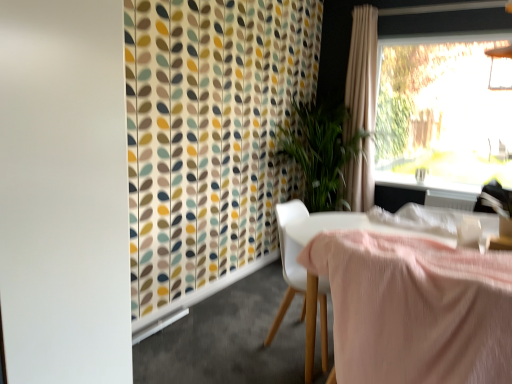
This screenshot has height=384, width=512. What do you see at coordinates (444, 112) in the screenshot? I see `transparent glass window at upper right` at bounding box center [444, 112].

This screenshot has height=384, width=512. I want to click on beige fabric curtain at upper right, so click(362, 71).

The width and height of the screenshot is (512, 384). What do you see at coordinates (64, 192) in the screenshot?
I see `white matte screen door at left` at bounding box center [64, 192].

I want to click on white plastic chair at center, so click(289, 261).

Where is `transparent glass window at upper right`? The height and width of the screenshot is (384, 512). transparent glass window at upper right is located at coordinates (444, 112).

Is point (424, 114) behind point (365, 93)?

Yes, it is.

Is transparent glass window at upper right in front of beige fabric curtain at upper right?

Yes, transparent glass window at upper right is closer to the camera.

From their relative heights in the image, would you say transparent glass window at upper right is taller or shorter than beige fabric curtain at upper right?

Clearly, transparent glass window at upper right is shorter compared to beige fabric curtain at upper right.

Does transparent glass window at upper right have a larger size compared to beige fabric curtain at upper right?

Incorrect, transparent glass window at upper right is not larger than beige fabric curtain at upper right.

Is white glossy window sill at upper right oriented towards white matte screen door at left?

No.

Considering the points (405, 175) and (110, 373), which point is in front, point (405, 175) or point (110, 373)?

The point (110, 373) is more forward.

How many degrees apart are the facing directions of white glossy window sill at upper right and white matte screen door at left?

There is a 180-degree angle between the facing directions of white glossy window sill at upper right and white matte screen door at left.

Can you confirm if white glossy window sill at upper right is shorter than white matte screen door at left?

Indeed, white glossy window sill at upper right has a lesser height compared to white matte screen door at left.

Could white plastic chair at center be considered to be inside beige fabric curtain at upper right?

No, white plastic chair at center is not surrounded by beige fabric curtain at upper right.

Is beige fabric curtain at upper right next to white plastic chair at center and touching it?

No, beige fabric curtain at upper right is not in contact with white plastic chair at center.

From a real-world perspective, is beige fabric curtain at upper right located beneath white plastic chair at center?

No, from a real-world perspective, beige fabric curtain at upper right is not under white plastic chair at center.

Is beige fabric curtain at upper right oriented towards white plastic chair at center?

Yes, beige fabric curtain at upper right is facing white plastic chair at center.

Where is `window sill behind the beige fabric curtain at upper right`? window sill behind the beige fabric curtain at upper right is located at coordinates (423, 183).

From a real-world perspective, which is physically above, beige fabric curtain at upper right or white glossy window sill at upper right?

Answer: From a 3D spatial view, beige fabric curtain at upper right is above.

Is white glossy window sill at upper right surrounded by beige fabric curtain at upper right?

Definitely not — white glossy window sill at upper right is not inside beige fabric curtain at upper right.

Which of these two, beige fabric curtain at upper right or white glossy window sill at upper right, is smaller?

With smaller size is white glossy window sill at upper right.

Could you tell me if white matte screen door at left is facing white plastic chair at center?

Yes, white matte screen door at left is aimed at white plastic chair at center.

From the image's perspective, is white matte screen door at left below white plastic chair at center?

Incorrect, from the image's perspective, white matte screen door at left is higher than white plastic chair at center.

Can you confirm if white matte screen door at left is positioned to the left of white plastic chair at center?

Yes.

In the image, is pink fabric-covered table at center on the left side or the right side of transparent glass window at upper right?

pink fabric-covered table at center is positioned on transparent glass window at upper right's left side.

Is pink fabric-covered table at center oriented away from transparent glass window at upper right?

That's not correct — pink fabric-covered table at center is not looking away from transparent glass window at upper right.

From a real-world perspective, does pink fabric-covered table at center stand above transparent glass window at upper right?

No, from a real-world perspective, pink fabric-covered table at center is not above transparent glass window at upper right.

Is pink fabric-covered table at center touching transparent glass window at upper right?

No, pink fabric-covered table at center is not making contact with transparent glass window at upper right.

How many degrees apart are the facing directions of white plastic chair at center and pink fabric-covered table at center?

There is a 88.7-degree angle between the facing directions of white plastic chair at center and pink fabric-covered table at center.

Which of these two, white plastic chair at center or pink fabric-covered table at center, stands shorter?

pink fabric-covered table at center.

From the image's perspective, is white plastic chair at center under pink fabric-covered table at center?

No, from the image's perspective, white plastic chair at center is not beneath pink fabric-covered table at center.

Relative to pink fabric-covered table at center, is white plastic chair at center in front or behind?

Visually, white plastic chair at center is located behind pink fabric-covered table at center.

The image size is (512, 384). In the image, there is a transparent glass window at upper right. In order to click on curtain below it (from the image's perspective) in this screenshot , I will do `click(362, 71)`.

Find the location of a particular element. The width and height of the screenshot is (512, 384). window sill above the white matte screen door at left (from the image's perspective) is located at coordinates (423, 183).

Looking at the image, which one is located closer to white glossy window sill at upper right, pink fabric-covered table at center or transparent glass window at upper right?

transparent glass window at upper right is positioned closer to the anchor white glossy window sill at upper right.

When comparing their distances from white plastic chair at center, does transparent glass window at upper right or white glossy window sill at upper right seem further?

The object further to white plastic chair at center is transparent glass window at upper right.

Estimate the real-world distances between objects in this image. Which object is further from beige fabric curtain at upper right, white matte screen door at left or transparent glass window at upper right?

white matte screen door at left lies further to beige fabric curtain at upper right than the other object.

Looking at the image, which one is located further to white glossy window sill at upper right, beige fabric curtain at upper right or transparent glass window at upper right?

beige fabric curtain at upper right.

From the image, which object appears to be farther from pink fabric-covered table at center, white matte screen door at left or beige fabric curtain at upper right?

beige fabric curtain at upper right lies further to pink fabric-covered table at center than the other object.

From the picture: From the image, which object appears to be nearer to white plastic chair at center, pink fabric-covered table at center or beige fabric curtain at upper right?

pink fabric-covered table at center lies closer to white plastic chair at center than the other object.

Estimate the real-world distances between objects in this image. Which object is further from beige fabric curtain at upper right, white glossy window sill at upper right or white plastic chair at center?

The object further to beige fabric curtain at upper right is white glossy window sill at upper right.

From the picture: From the image, which object appears to be farther from white plastic chair at center, white glossy window sill at upper right or transparent glass window at upper right?

The object further to white plastic chair at center is transparent glass window at upper right.

Identify the location of window positioned between white plastic chair at center and beige fabric curtain at upper right from near to far. (444, 112).

Locate an element on the screen. table between white matte screen door at left and transparent glass window at upper right along the z-axis is located at coordinates (329, 254).

Locate an element on the screen. The height and width of the screenshot is (384, 512). chair between white matte screen door at left and beige fabric curtain at upper right along the z-axis is located at coordinates (289, 261).

Identify the location of table between white matte screen door at left and beige fabric curtain at upper right from front to back. The width and height of the screenshot is (512, 384). coord(329,254).